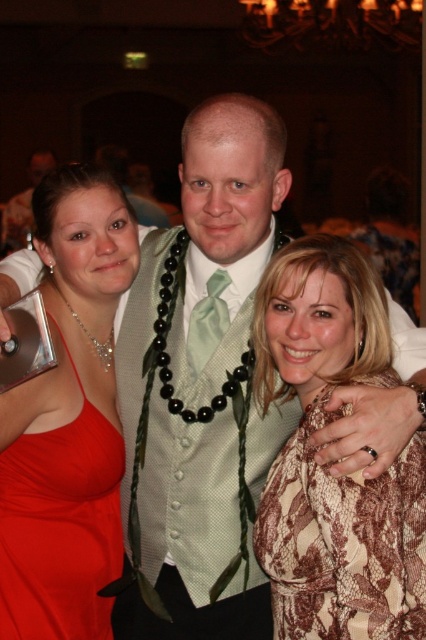
Between brown textured dress at center and satin green tie at center, which one has more height?

With more height is brown textured dress at center.

Is brown textured dress at center shorter than satin green tie at center?

Incorrect, brown textured dress at center's height does not fall short of satin green tie at center's.

Is point (351, 296) behind point (221, 323)?

No.

Image resolution: width=426 pixels, height=640 pixels. In order to click on brown textured dress at center in this screenshot , I will do `click(322, 468)`.

Can you confirm if brown textured dress at center is thinner than matte red dress at left?

No, brown textured dress at center is not thinner than matte red dress at left.

Measure the distance between brown textured dress at center and matte red dress at left.

They are 1.07 meters apart.

Is point (408, 481) positioned before point (40, 492)?

Yes, point (408, 481) is closer to viewer.

Where is `brown textured dress at center`? brown textured dress at center is located at coordinates (322, 468).

Between matte red dress at left and satin green tie at center, which one is positioned lower?

Positioned lower is matte red dress at left.

At what (x,y) coordinates should I click in order to perform the action: click on matte red dress at left. Please return your answer as a coordinate pair (x, y). This screenshot has height=640, width=426. Looking at the image, I should click on (60, 529).

Who is more distant from viewer, (40, 548) or (221, 326)?

The point (221, 326) is more distant.

The height and width of the screenshot is (640, 426). I want to click on matte red dress at left, so click(x=60, y=529).